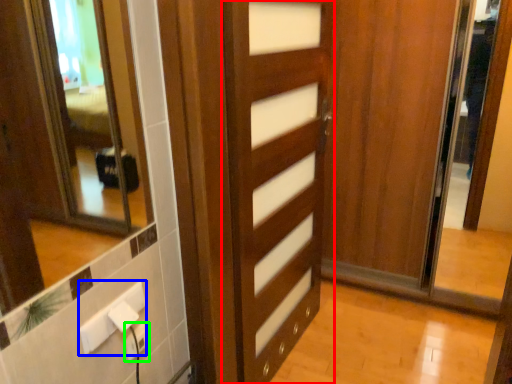
Question: Which object is positioned closest to door (highlighted by a red box)? Select from electric outlet (highlighted by a blue box) and electric outlet (highlighted by a green box).

Choices:
 (A) electric outlet
 (B) electric outlet

Answer: (A)